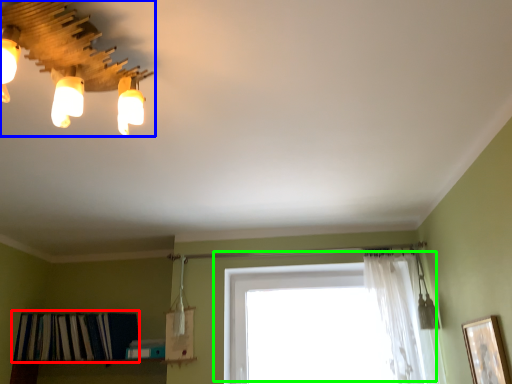
Question: Considering the real-world distances, which object is farthest from shelf (highlighted by a red box)? lamp (highlighted by a blue box) or window (highlighted by a green box)?

Choices:
 (A) lamp
 (B) window

Answer: (A)